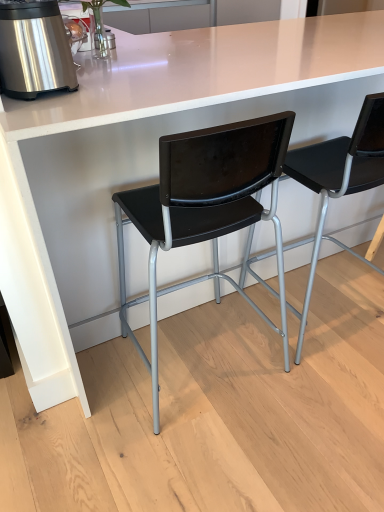
Question: Is black plastic chair at center, which is counted as the 2th chair, starting from the right, wider or thinner than stainless steel appliance at left?

Choices:
 (A) wide
 (B) thin

Answer: (A)

Question: Is black plastic chair at center, which is counted as the 2th chair, starting from the right, inside or outside of stainless steel appliance at left?

Choices:
 (A) inside
 (B) outside

Answer: (B)

Question: Based on their relative distances, which object is farther from the stainless steel appliance at left?

Choices:
 (A) black plastic chair at center, which is the first chair from left to right
 (B) black plastic chair at center, positioned as the second chair in left-to-right order

Answer: (B)

Question: Estimate the real-world distances between objects in this image. Which object is closer to the stainless steel appliance at left?

Choices:
 (A) black plastic chair at center, positioned as the second chair in left-to-right order
 (B) black plastic chair at center, which is counted as the 2th chair, starting from the right

Answer: (B)